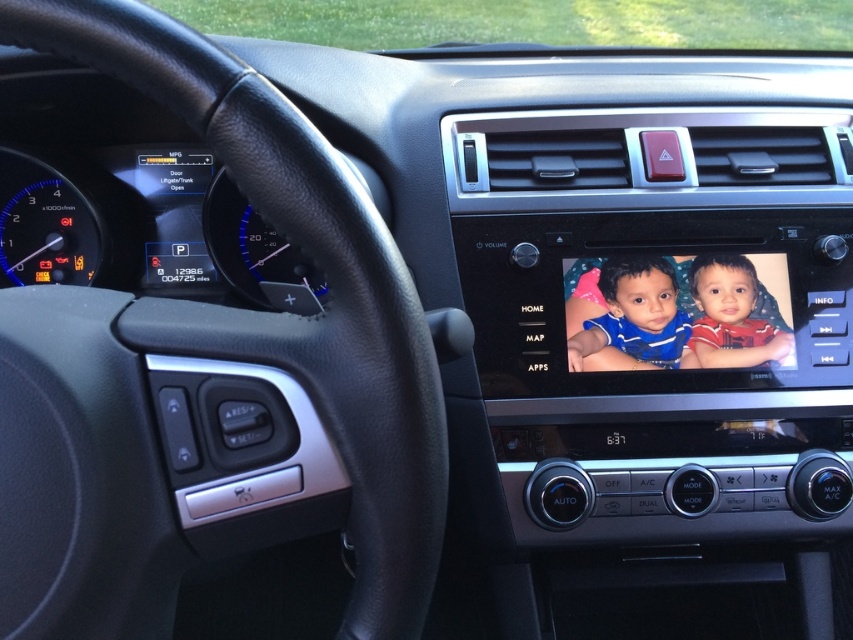
You are a parent deciding which item to place in the center console of your car. You have a blue fabric baby at center and a matte red shirt at center. Which item will occupy more space in the center console?

The blue fabric baby at center has a larger size compared to matte red shirt at center, so it will occupy more space in the center console.

You are a passenger in the car and see the blue fabric baby at center and the matte red shirt at center. Which one is located to the left of the other?

The blue fabric baby at center is positioned on the left side of matte red shirt at center.